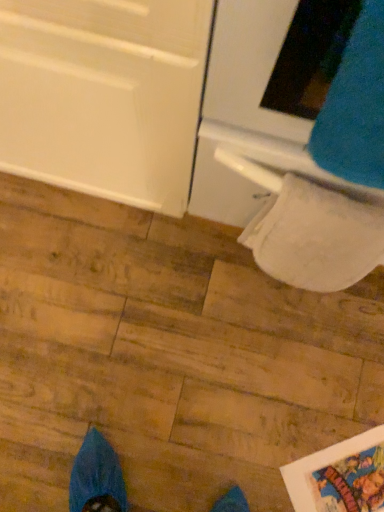
Question: Is white glossy oven at upper right positioned behind blue fuzzy sweat pants at upper right?

Choices:
 (A) yes
 (B) no

Answer: (A)

Question: Can you confirm if white glossy oven at upper right is bigger than blue fuzzy sweat pants at upper right?

Choices:
 (A) no
 (B) yes

Answer: (B)

Question: Is white glossy oven at upper right at the left side of blue fuzzy sweat pants at upper right?

Choices:
 (A) no
 (B) yes

Answer: (A)

Question: Can you confirm if white glossy oven at upper right is wider than blue fuzzy sweat pants at upper right?

Choices:
 (A) yes
 (B) no

Answer: (A)

Question: From the image's perspective, would you say white glossy oven at upper right is shown under blue fuzzy sweat pants at upper right?

Choices:
 (A) no
 (B) yes

Answer: (A)

Question: From a real-world perspective, is white glossy oven at upper right physically below blue fuzzy sweat pants at upper right?

Choices:
 (A) yes
 (B) no

Answer: (A)

Question: Is blue fuzzy sweat pants at upper right positioned with its back to white glossy oven at upper right?

Choices:
 (A) yes
 (B) no

Answer: (A)

Question: Does blue fuzzy sweat pants at upper right turn towards white glossy oven at upper right?

Choices:
 (A) no
 (B) yes

Answer: (B)

Question: Does blue fuzzy sweat pants at upper right have a lesser width compared to white glossy oven at upper right?

Choices:
 (A) no
 (B) yes

Answer: (B)

Question: Is blue fuzzy sweat pants at upper right behind white glossy oven at upper right?

Choices:
 (A) yes
 (B) no

Answer: (B)

Question: Is white glossy oven at upper right inside blue fuzzy sweat pants at upper right?

Choices:
 (A) yes
 (B) no

Answer: (B)

Question: Is blue fuzzy sweat pants at upper right placed right next to white glossy oven at upper right?

Choices:
 (A) no
 (B) yes

Answer: (A)

Question: Does white textured toilet paper at lower right have a smaller size compared to blue fuzzy sweat pants at upper right?

Choices:
 (A) no
 (B) yes

Answer: (B)